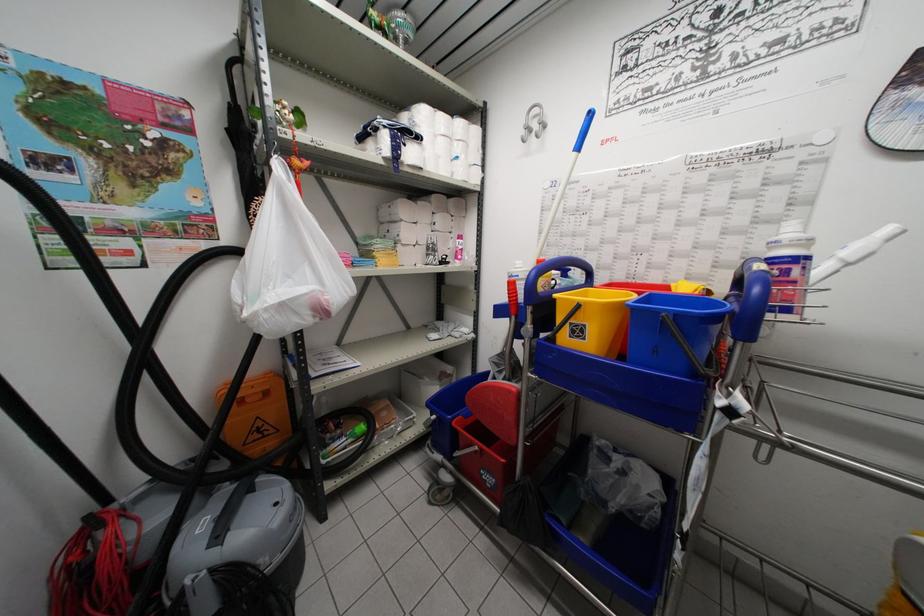
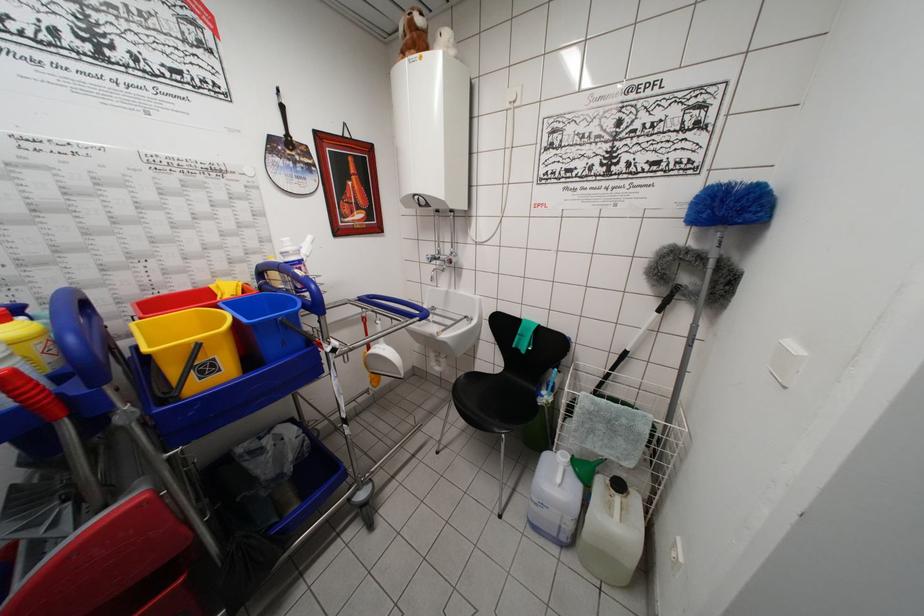
Locate, in the second image, the point that corresponds to [581,308] in the first image.

(200, 349)